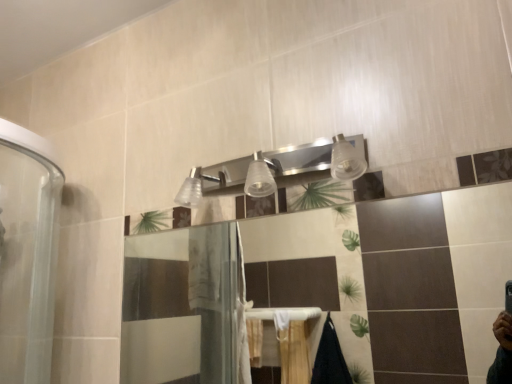
This screenshot has width=512, height=384. Identify the location of metallic mirror at upper center. (272, 170).

The width and height of the screenshot is (512, 384). Describe the element at coordinates (272, 170) in the screenshot. I see `metallic mirror at upper center` at that location.

Where is `metallic mirror at upper center`? metallic mirror at upper center is located at coordinates (272, 170).